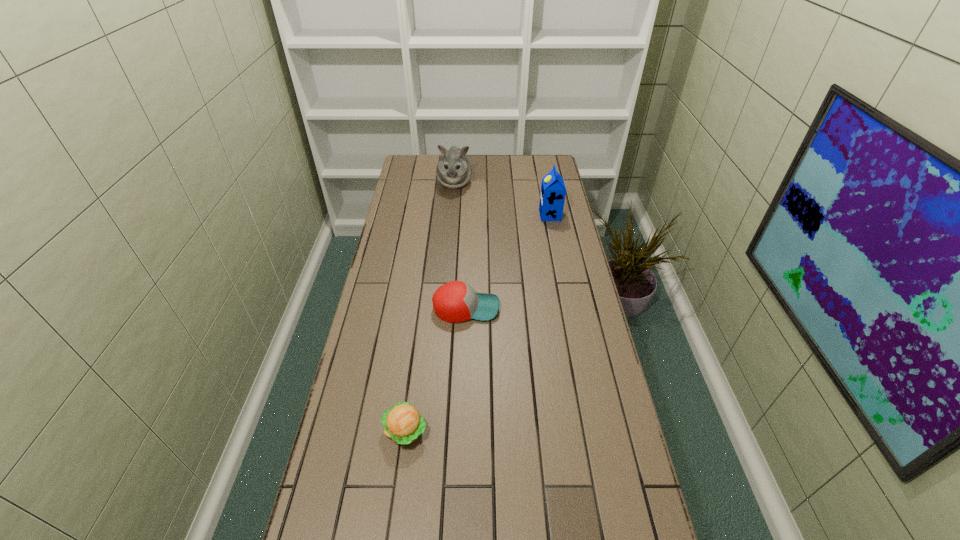
Find the location of a particular element. vacant space that's between the farthest object and the hamburger is located at coordinates (430, 307).

You are a GUI agent. You are given a task and a screenshot of the screen. Output one action in this format:
    pyautogui.click(x=<x>, y=<y>)
    Task: Click on the unoccupied area between the hamburger and the second nearest object
    The width and height of the screenshot is (960, 540).
    Given the screenshot: What is the action you would take?
    pyautogui.click(x=436, y=369)

Identify the location of blank region between the carton and the baseball cap. Image resolution: width=960 pixels, height=540 pixels. (508, 261).

The width and height of the screenshot is (960, 540). In order to click on free spot between the nearest object and the carton in this screenshot , I will do `click(478, 323)`.

This screenshot has width=960, height=540. Find the location of `vacant space that is in between the second farthest object and the baseball cap`. vacant space that is in between the second farthest object and the baseball cap is located at coordinates (508, 261).

Where is `free area in between the hamburger and the second nearest object`? Image resolution: width=960 pixels, height=540 pixels. free area in between the hamburger and the second nearest object is located at coordinates (436, 369).

The width and height of the screenshot is (960, 540). I want to click on vacant space that's between the nearest object and the baseball cap, so click(436, 369).

This screenshot has height=540, width=960. In order to click on free space between the nearest object and the second farthest object in this screenshot , I will do `click(478, 323)`.

Identify which object is the second closest to the third farthest object. Please provide its 2D coordinates. Your answer should be formatted as a tuple, i.e. [(x, y)], where the tuple contains the x and y coordinates of a point satisfying the conditions above.

[(552, 197)]

Identify which object is the second closest to the farthest object. Please provide its 2D coordinates. Your answer should be formatted as a tuple, i.e. [(x, y)], where the tuple contains the x and y coordinates of a point satisfying the conditions above.

[(456, 301)]